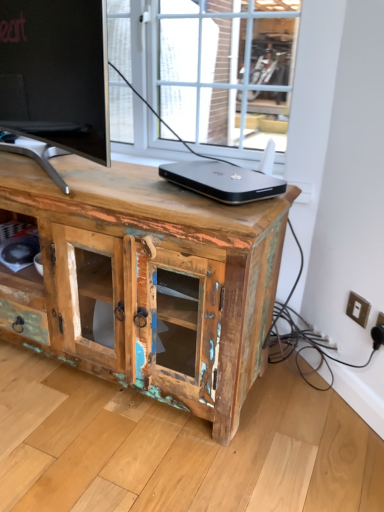
I want to click on vacant space in front of sleek silver laptop at center, so click(x=211, y=206).